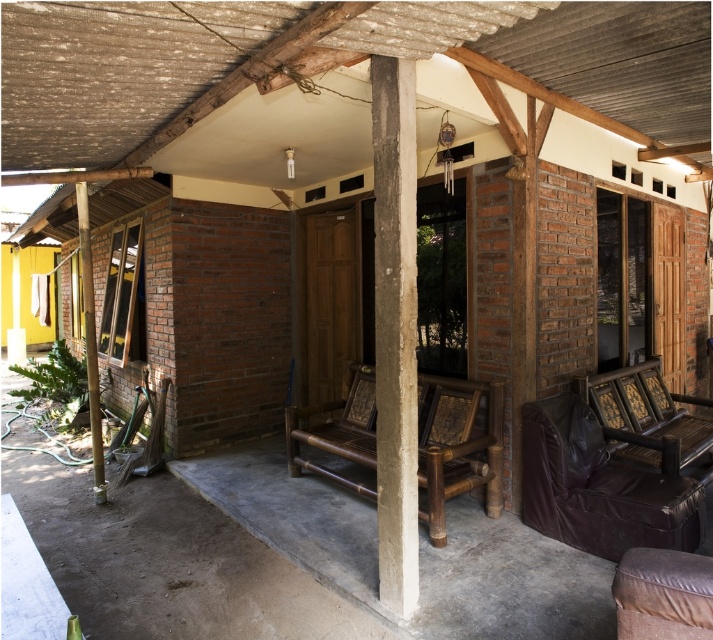
Question: Is brown leather armchair at center bigger than brown wooden armchair at lower right?

Choices:
 (A) yes
 (B) no

Answer: (B)

Question: Which of the following is the closest to the observer?

Choices:
 (A) brown wooden armchair at lower right
 (B) concrete at center

Answer: (B)

Question: Which object is farther from the camera taking this photo?

Choices:
 (A) brown wooden armchair at lower right
 (B) brown leather armchair at center

Answer: (A)

Question: Can you confirm if brown wooden bench at center is positioned above brown wooden armchair at lower right?

Choices:
 (A) no
 (B) yes

Answer: (A)

Question: Is brown wooden bench at center further to camera compared to brown wooden armchair at lower right?

Choices:
 (A) no
 (B) yes

Answer: (A)

Question: Which point is closer to the camera?

Choices:
 (A) brown leather armchair at center
 (B) concrete at center

Answer: (B)